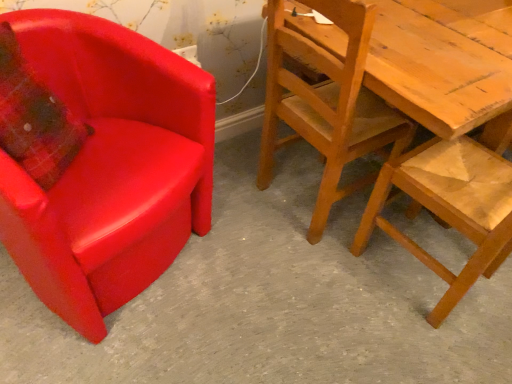
Question: Can you confirm if wooden chair at right, the second chair positioned from the left, is bigger than wooden textured chair at right, which ranks as the third chair in left-to-right order?

Choices:
 (A) no
 (B) yes

Answer: (B)

Question: From the image's perspective, would you say wooden chair at right, positioned as the 2th chair in right-to-left order, is shown under wooden textured chair at right, which ranks as the third chair in left-to-right order?

Choices:
 (A) no
 (B) yes

Answer: (A)

Question: From a real-world perspective, is wooden chair at right, positioned as the 2th chair in right-to-left order, below wooden textured chair at right, which is the 1th chair from right to left?

Choices:
 (A) yes
 (B) no

Answer: (B)

Question: Considering the relative positions of wooden chair at right, the second chair positioned from the left, and wooden textured chair at right, which ranks as the third chair in left-to-right order, in the image provided, is wooden chair at right, the second chair positioned from the left, to the left of wooden textured chair at right, which ranks as the third chair in left-to-right order, from the viewer's perspective?

Choices:
 (A) no
 (B) yes

Answer: (B)

Question: From a real-world perspective, is wooden chair at right, positioned as the 2th chair in right-to-left order, physically above wooden textured chair at right, which ranks as the third chair in left-to-right order?

Choices:
 (A) yes
 (B) no

Answer: (A)

Question: Is wooden chair at right, the second chair positioned from the left, positioned with its back to wooden textured chair at right, which is the 1th chair from right to left?

Choices:
 (A) no
 (B) yes

Answer: (A)

Question: Is wooden textured chair at right, which ranks as the third chair in left-to-right order, completely or partially inside matte plastic chair at left?

Choices:
 (A) yes
 (B) no

Answer: (B)

Question: Is matte plastic chair at left thinner than wooden textured chair at right, which ranks as the third chair in left-to-right order?

Choices:
 (A) yes
 (B) no

Answer: (B)

Question: Can you confirm if matte plastic chair at left is smaller than wooden textured chair at right, which is the 1th chair from right to left?

Choices:
 (A) yes
 (B) no

Answer: (A)

Question: Could you tell me if matte plastic chair at left is turned towards wooden textured chair at right, which is the 1th chair from right to left?

Choices:
 (A) no
 (B) yes

Answer: (A)

Question: From a real-world perspective, is matte plastic chair at left on top of wooden textured chair at right, which ranks as the third chair in left-to-right order?

Choices:
 (A) yes
 (B) no

Answer: (B)

Question: Is matte plastic chair at left positioned with its back to wooden textured chair at right, which is the 1th chair from right to left?

Choices:
 (A) yes
 (B) no

Answer: (B)

Question: Could wooden textured chair at right, which ranks as the third chair in left-to-right order, be considered to be inside matte red armchair at left, marked as the first chair in a left-to-right arrangement?

Choices:
 (A) no
 (B) yes

Answer: (A)